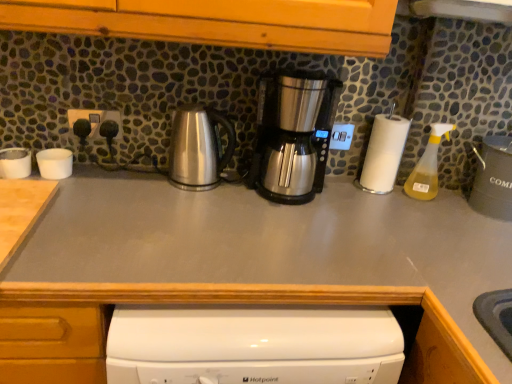
Question: Relative to white matte cups at left, which is counted as the 2th appliance, starting from the left, is gray matte countertop at center in front or behind?

Choices:
 (A) front
 (B) behind

Answer: (A)

Question: In terms of size, does gray matte countertop at center appear bigger or smaller than white matte cups at left, which is counted as the 2th appliance, starting from the left?

Choices:
 (A) big
 (B) small

Answer: (A)

Question: Estimate the real-world distances between objects in this image. Which object is closer to the yellow translucent spray bottle at right?

Choices:
 (A) gray matte countertop at left
 (B) satin silver kettle at center, marked as the 2th kitchen appliance in a right-to-left arrangement
 (C) stainless steel coffee maker at center, acting as the first kitchen appliance starting from the right
 (D) white plastic cups at left, arranged as the first appliance when viewed from the left
 (E) white paper towel at right

Answer: (E)

Question: Which of these objects is positioned farthest from the yellow translucent spray bottle at right?

Choices:
 (A) matte gray canister at right, the third appliance positioned from the left
 (B) gray matte countertop at center
 (C) stainless steel coffee maker at center, marked as the 2th kitchen appliance in a left-to-right arrangement
 (D) white paper towel at right
 (E) white matte cups at left, arranged as the 2th appliance when viewed from the right

Answer: (E)